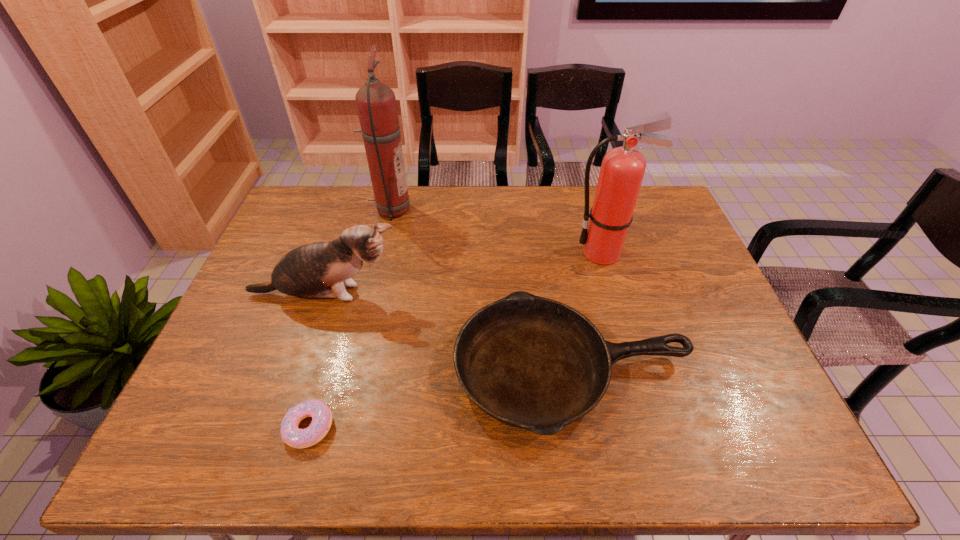
Locate an element on the screen. vacant space at the near edge is located at coordinates click(x=254, y=426).

This screenshot has width=960, height=540. Find the location of `free space at the left edge`. free space at the left edge is located at coordinates (246, 388).

In order to click on vacant area at the right edge of the desktop in this screenshot , I will do `click(684, 334)`.

Identify the location of blank region between the farther fire extinguisher and the doughnut. (349, 319).

Where is `free area in between the cat and the fourth tallest object`? This screenshot has width=960, height=540. free area in between the cat and the fourth tallest object is located at coordinates (448, 332).

Locate an element on the screen. Image resolution: width=960 pixels, height=540 pixels. vacant point located between the left fire extinguisher and the right fire extinguisher is located at coordinates (496, 232).

In order to click on vacant space that is in between the left fire extinguisher and the frying pan in this screenshot , I will do `click(481, 290)`.

Locate an element on the screen. This screenshot has width=960, height=540. empty space that is in between the shortest object and the third tallest object is located at coordinates (317, 361).

Image resolution: width=960 pixels, height=540 pixels. I want to click on empty space that is in between the frying pan and the left fire extinguisher, so click(x=481, y=290).

In order to click on empty space between the doughnut and the frying pan in this screenshot , I will do `click(441, 399)`.